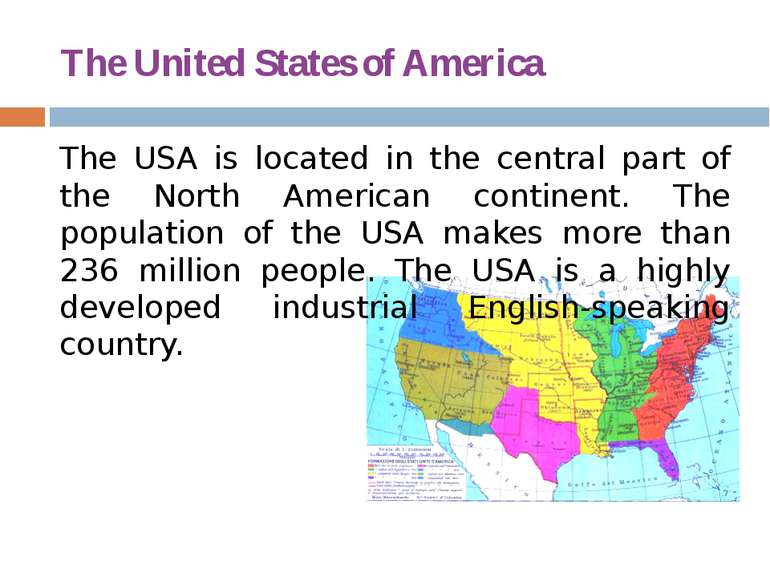
At what (x,y) coordinates should I click in order to perform the action: click on map of the u.s. Please return your answer as a coordinate pair (x, y). Looking at the image, I should click on (553, 383).